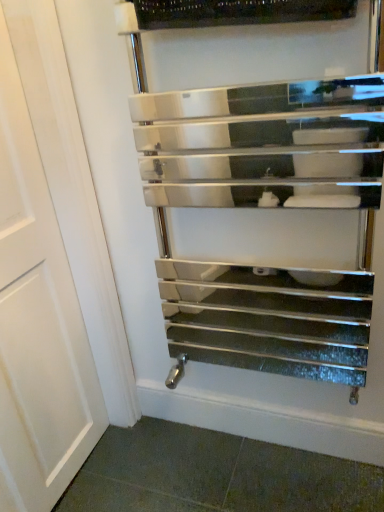
Locate an element on the screen. polished chrome towel rack at center is located at coordinates (265, 208).

This screenshot has width=384, height=512. Describe the element at coordinates (265, 208) in the screenshot. I see `polished chrome towel rack at center` at that location.

Measure the distance between polished chrome towel rack at center and camera.

Answer: The distance of polished chrome towel rack at center from camera is 33.20 inches.

What do you see at coordinates (37, 292) in the screenshot? I see `white matte door at center` at bounding box center [37, 292].

What is the approximate height of white matte door at center?

white matte door at center is 1.48 meters tall.

Locate an element on the screen. This screenshot has width=384, height=512. white matte door at center is located at coordinates (37, 292).

Identify the location of polished chrome towel rack at center. (265, 208).

In the image, is polished chrome towel rack at center on the left side or the right side of white matte door at center?

polished chrome towel rack at center is to the right of white matte door at center.

Which object is more forward, polished chrome towel rack at center or white matte door at center?

white matte door at center is in front.

Between point (359, 204) and point (34, 294), which one is positioned behind?

The point (359, 204) is behind.

From the image's perspective, is polished chrome towel rack at center on white matte door at center?

Yes.

From a real-world perspective, is polished chrome towel rack at center below white matte door at center?

No, from a real-world perspective, polished chrome towel rack at center is not under white matte door at center.

Can you confirm if polished chrome towel rack at center is thinner than white matte door at center?

No.

Is polished chrome towel rack at center taller or shorter than white matte door at center?

Considering their sizes, polished chrome towel rack at center has less height than white matte door at center.

Is polished chrome towel rack at center smaller than white matte door at center?

No.

Would you say polished chrome towel rack at center is inside or outside white matte door at center?

polished chrome towel rack at center lies outside white matte door at center.

In the scene shown: Is polished chrome towel rack at center far from white matte door at center?

That's not correct — polished chrome towel rack at center is a little close to white matte door at center.

Is polished chrome towel rack at center turned away from white matte door at center?

No, polished chrome towel rack at center is not facing the opposite direction of white matte door at center.

The image size is (384, 512). I want to click on door on the left of polished chrome towel rack at center, so click(x=37, y=292).

Considering the relative positions of white matte door at center and polished chrome towel rack at center in the image provided, is white matte door at center to the left or to the right of polished chrome towel rack at center?

Based on their positions, white matte door at center is located to the left of polished chrome towel rack at center.

Looking at this image, does white matte door at center lie in front of polished chrome towel rack at center?

Yes, it is.

Considering the positions of points (39, 94) and (275, 296), is point (39, 94) farther from camera compared to point (275, 296)?

No, (39, 94) is in front of (275, 296).

From the image's perspective, would you say white matte door at center is positioned over polished chrome towel rack at center?

No, from the image's perspective, white matte door at center is not on top of polished chrome towel rack at center.

From a real-world perspective, is white matte door at center on top of polished chrome towel rack at center?

No, from a real-world perspective, white matte door at center is not over polished chrome towel rack at center

Which object is wider, white matte door at center or polished chrome towel rack at center?

polished chrome towel rack at center.

Can you confirm if white matte door at center is shorter than polished chrome towel rack at center?

In fact, white matte door at center may be taller than polished chrome towel rack at center.

Who is bigger, white matte door at center or polished chrome towel rack at center?

With larger size is polished chrome towel rack at center.

Would you say white matte door at center is inside or outside polished chrome towel rack at center?

The correct answer is: outside.

Would you consider white matte door at center to be distant from polished chrome towel rack at center?

white matte door at center is near polished chrome towel rack at center, not far away.

Does white matte door at center turn towards polished chrome towel rack at center?

Yes, white matte door at center faces towards polished chrome towel rack at center.

What are the coordinates of `shelf lying above the white matte door at center (from the image's perspective)` in the screenshot? It's located at (265, 208).

Image resolution: width=384 pixels, height=512 pixels. Identify the location of door in front of the polished chrome towel rack at center. (37, 292).

Where is `shelf lying on the right of white matte door at center`? shelf lying on the right of white matte door at center is located at coordinates (265, 208).